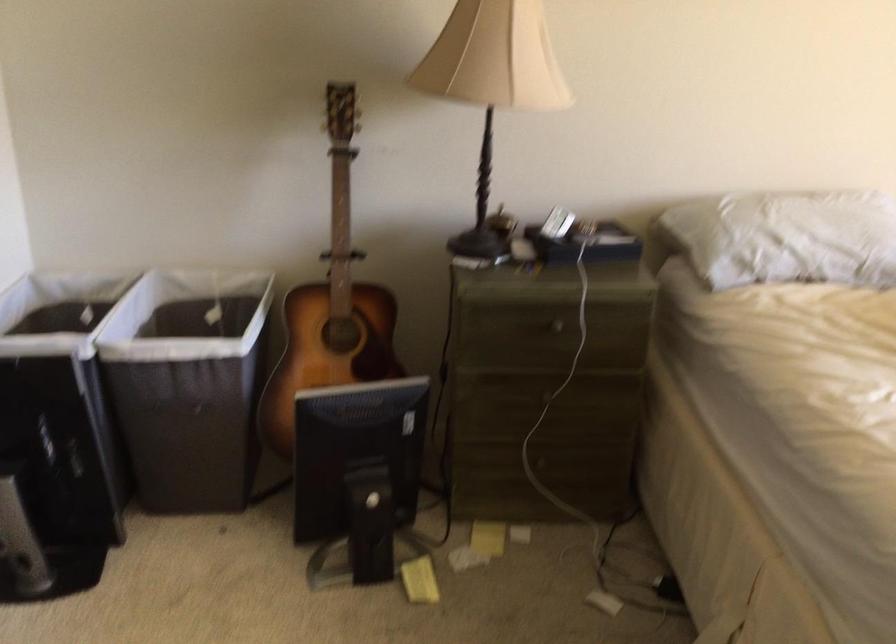
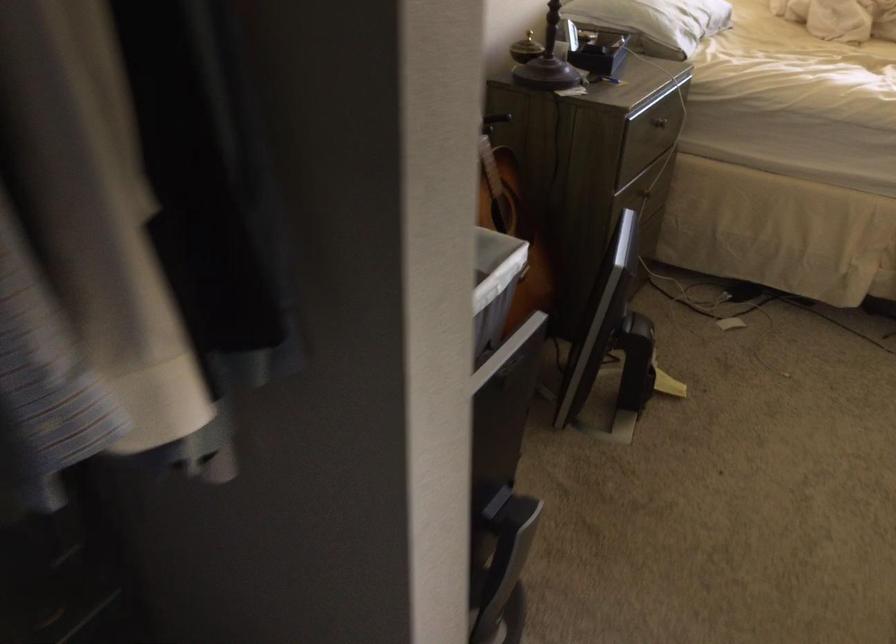
Find the pixel in the second image that matches point 544,395 in the first image.

(645, 194)